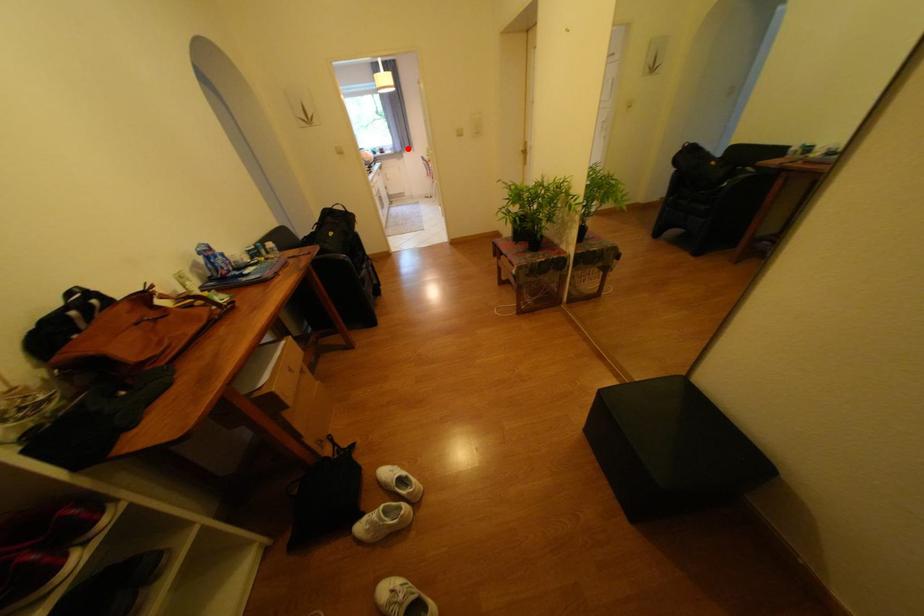
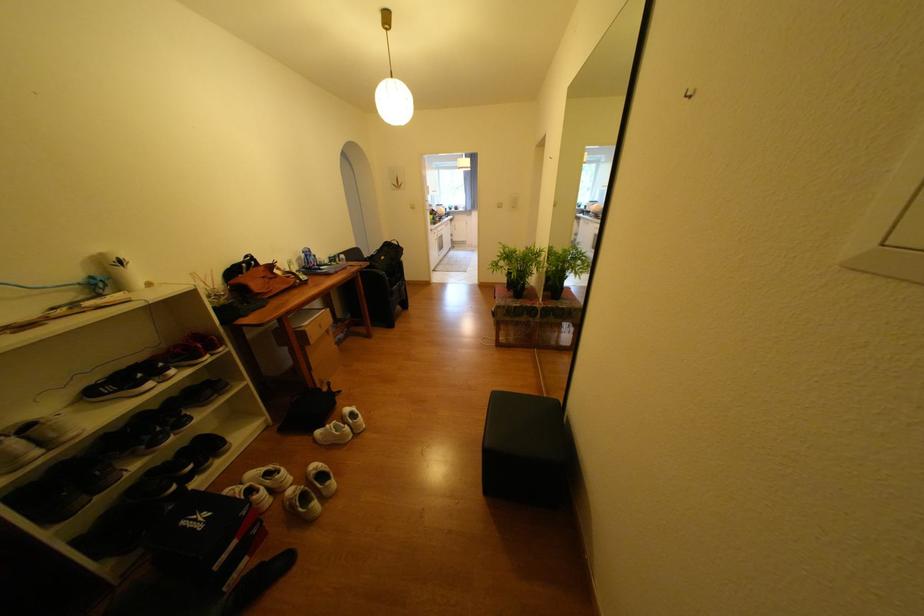
The point at the highlighted location is marked in the first image. Where is the corresponding point in the second image?

(479, 208)